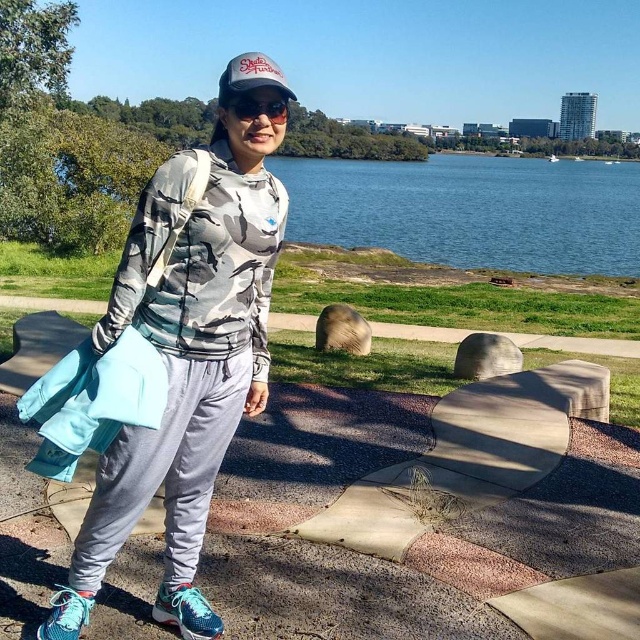
You are planning to take a photo of the person wearing the camo fabric hoodie at center and the blue water at center. Based on their positions, which object is closer to the camera?

The camo fabric hoodie at center is shorter than blue water at center, so the blue water at center is closer to the camera.

You are a photographer trying to capture the person in the camo fabric hoodie at center. You want to take a photo that includes both the person and the calm body of water in the background. Given that you are standing 6.61 feet away from the person, can you estimate if your camera lens can capture both the person and the water in one frame?

The person in the camo fabric hoodie at center is 6.61 feet away from you. Since the water is in the background beyond the grassy area, it should be visible in the frame if your camera lens has a wide enough angle to include both the subject at that distance and the background scenery.

From the picture: You are navigating a drone from the starting point to the endpoint in the park. The starting point is at point (252, 106) and the endpoint is at point (616, 240). Based on the scene description, will the drone have a clear path between these two points without any obstructions?

Result: Point (616, 240) is behind point (252, 106), so the drone might be blocked by the person or objects between them, so the path may not be clear.